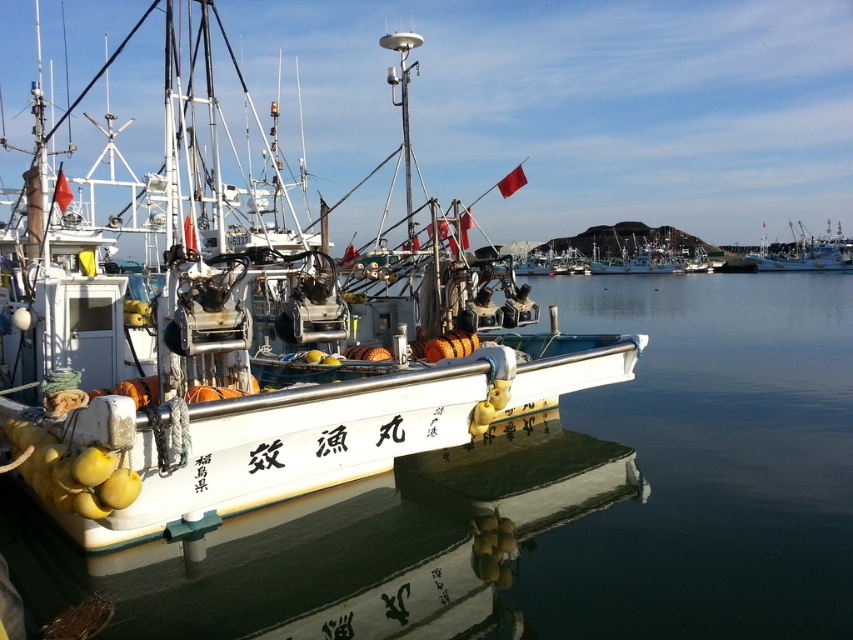
Question: Can you confirm if white glossy water at center is positioned below white matte boat at center?

Choices:
 (A) no
 (B) yes

Answer: (B)

Question: Where is white matte boat at center located in relation to white matte boat at right in the image?

Choices:
 (A) right
 (B) left

Answer: (B)

Question: Among these objects, which one is nearest to the camera?

Choices:
 (A) white matte boat at center
 (B) white glossy water at center

Answer: (A)

Question: Is white matte boat at center wider than white matte boat at right?

Choices:
 (A) no
 (B) yes

Answer: (B)

Question: Which of these objects is positioned closest to the white matte boat at right?

Choices:
 (A) white matte boat at center
 (B) white glossy water at center

Answer: (B)

Question: Among these objects, which one is farthest from the camera?

Choices:
 (A) white glossy water at center
 (B) white matte boat at center
 (C) white matte boat at right

Answer: (C)